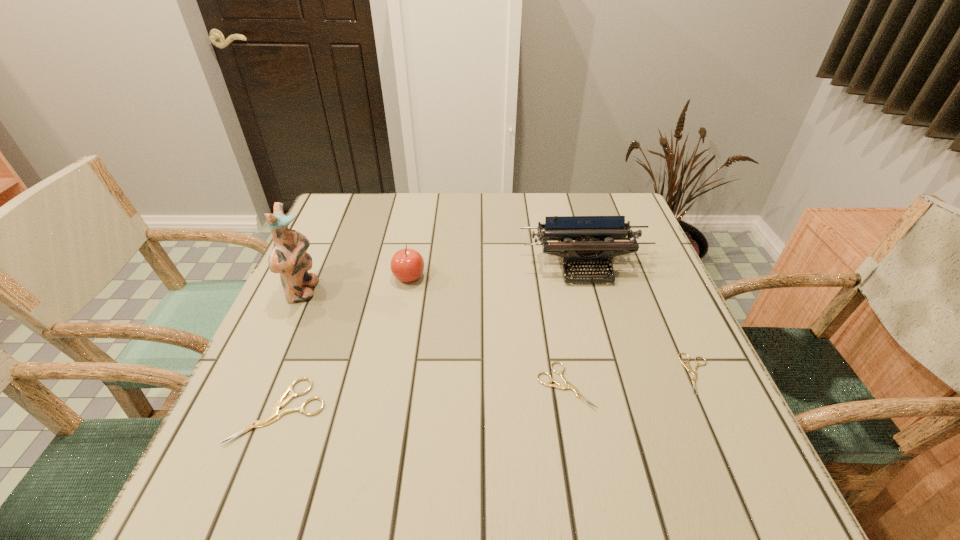
Find the location of a particular element. The image size is (960, 540). the leftmost shears is located at coordinates (275, 413).

Locate an element on the screen. The image size is (960, 540). the tallest shears is located at coordinates pos(275,413).

At what (x,y) coordinates should I click in order to perform the action: click on the second shears from right to left. Please return your answer as a coordinate pair (x, y). Image resolution: width=960 pixels, height=540 pixels. Looking at the image, I should click on (567, 385).

The width and height of the screenshot is (960, 540). Find the location of `the second shortest shears`. the second shortest shears is located at coordinates (567, 385).

Where is `the shortest shears`? This screenshot has height=540, width=960. the shortest shears is located at coordinates (688, 367).

The width and height of the screenshot is (960, 540). I want to click on the shortest object, so click(x=688, y=367).

This screenshot has height=540, width=960. What are the coordinates of `the third tallest object` in the screenshot? It's located at (407, 265).

The height and width of the screenshot is (540, 960). Identify the location of apple. (407, 265).

Where is `the fifth shortest object`? the fifth shortest object is located at coordinates (594, 246).

In order to click on figurine in this screenshot , I will do `click(288, 256)`.